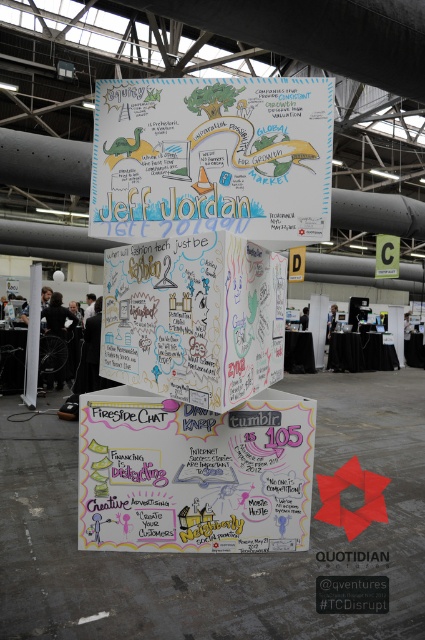
Which is above, white paperboard at center or white chalkboard at center?

Positioned higher is white paperboard at center.

Where is `white paperboard at center`? white paperboard at center is located at coordinates (212, 157).

Looking at this image, between white paperboard at center and white cardboard box at center, which one has more height?

white paperboard at center

Does white paperboard at center have a greater height compared to white cardboard box at center?

Correct, white paperboard at center is much taller as white cardboard box at center.

Locate an element on the screen. white paperboard at center is located at coordinates (212, 157).

Find the location of `white paperboard at center`. white paperboard at center is located at coordinates (212, 157).

Does point (104, 433) lie behind point (195, 371)?

Yes.

Which is below, white chalkboard at center or white cardboard box at center?

Positioned lower is white chalkboard at center.

Is point (266, 484) more distant than point (231, 292)?

Yes.

Locate an element on the screen. This screenshot has width=425, height=640. white chalkboard at center is located at coordinates (193, 474).